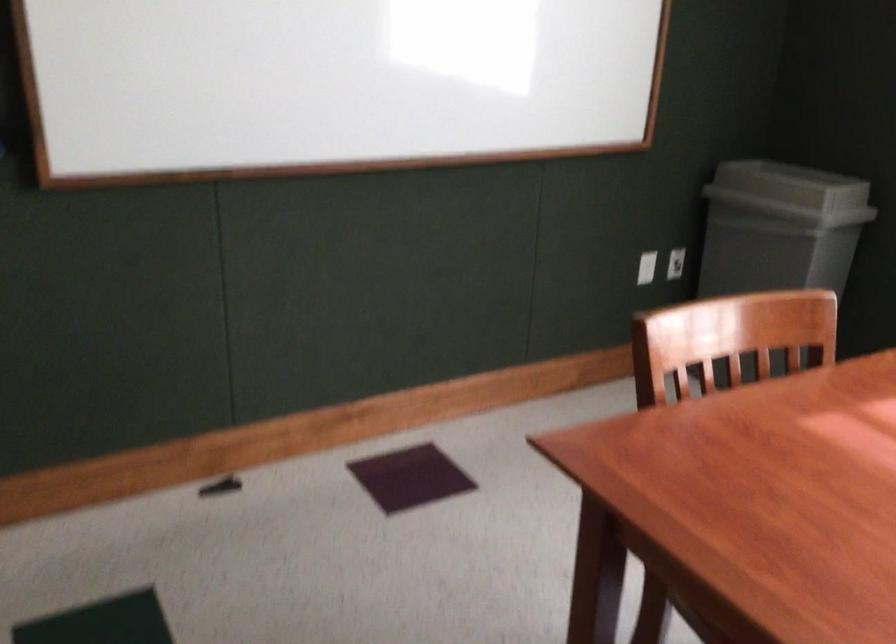
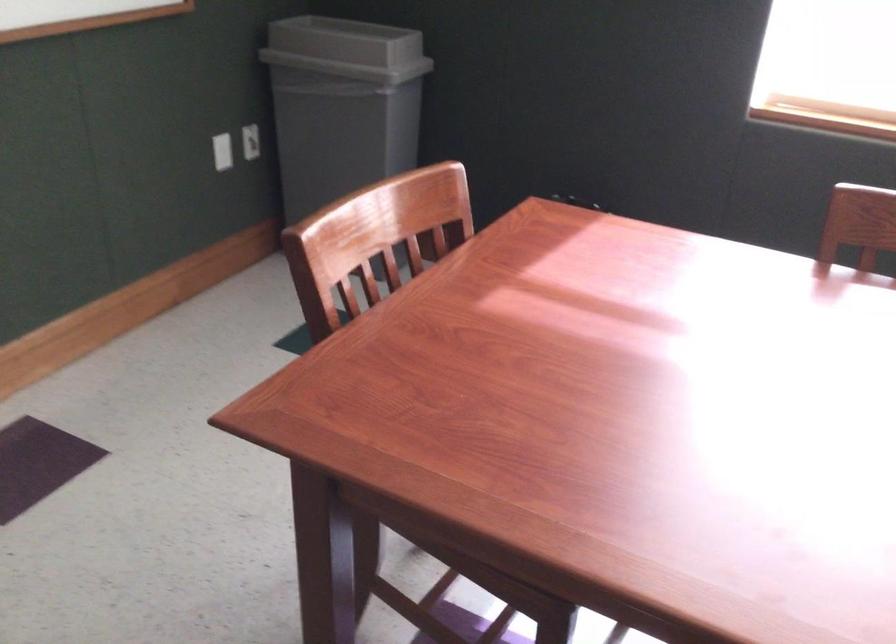
Question: The images are taken continuously from a first-person perspective. In which direction is your viewpoint rotating?

Choices:
 (A) Left
 (B) Right
 (C) Up
 (D) Down

Answer: (B)